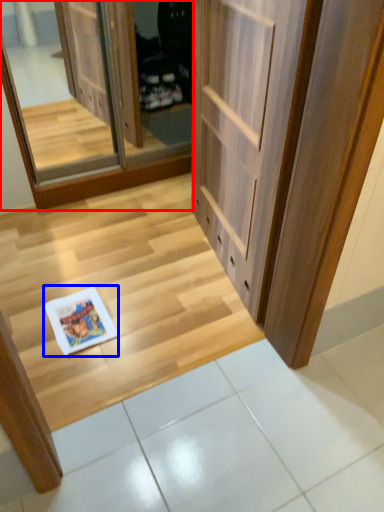
Question: Which point is further to the camera, screen door (highlighted by a red box) or magazine (highlighted by a blue box)?

Choices:
 (A) screen door
 (B) magazine

Answer: (A)